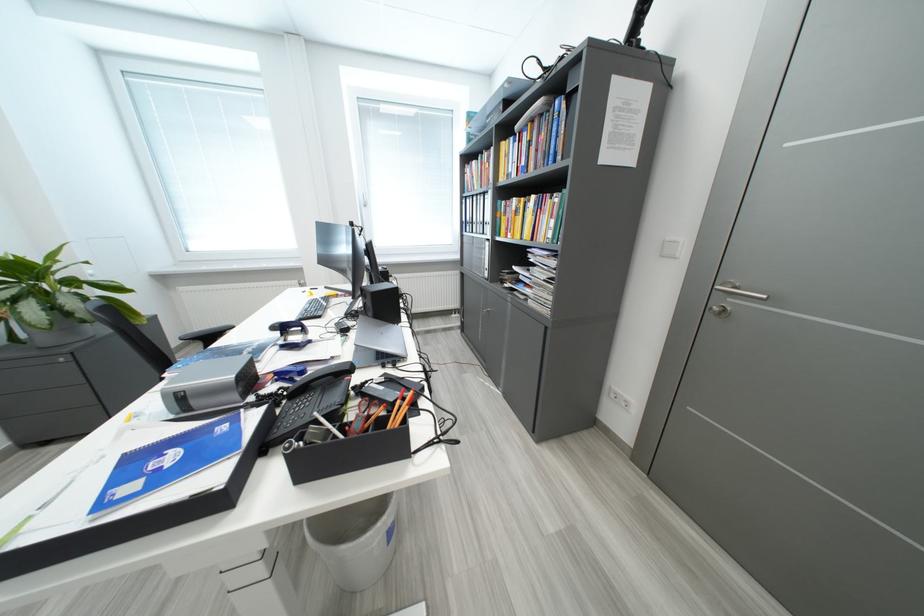
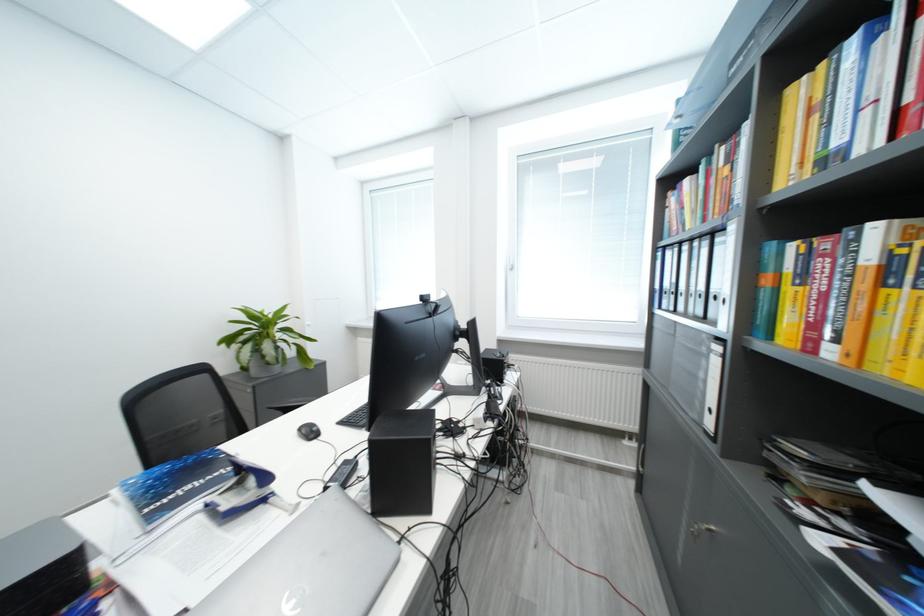
Where in the second image is the point corresponding to [470,201] from the first image?

(664, 253)